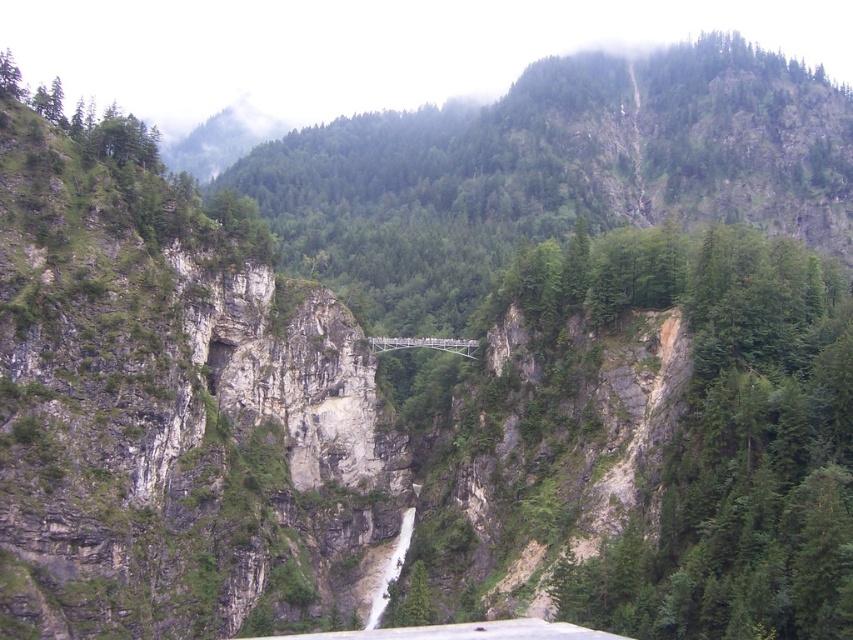
You are a hiker planning to cross the suspension bridge in the midground. You notice the green rock cliff at center and the white stone waterfall at center. Which object is closer to you as you stand on the bridge?

The green rock cliff at center is closer to the viewer than the white stone waterfall at center.